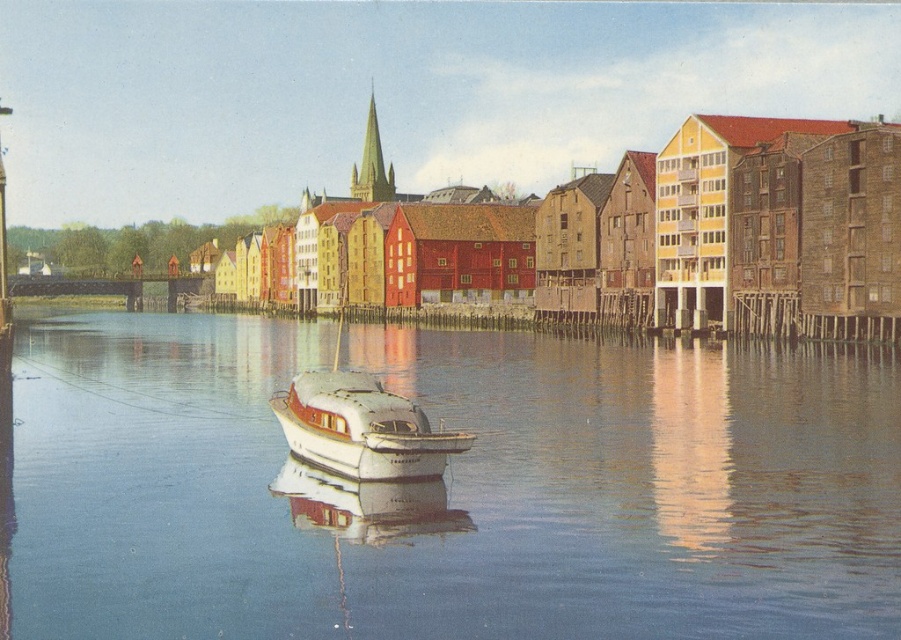
Question: Among these objects, which one is nearest to the camera?

Choices:
 (A) white glossy boat at center
 (B) blue smooth water at center

Answer: (B)

Question: Which point appears closest to the camera in this image?

Choices:
 (A) (365, 163)
 (B) (143, 497)

Answer: (B)

Question: Does white glossy boat at center appear over green stone spire at upper center?

Choices:
 (A) no
 (B) yes

Answer: (A)

Question: Is blue smooth water at center above white glossy boat at center?

Choices:
 (A) yes
 (B) no

Answer: (B)

Question: Can you confirm if white glossy boat at center is bigger than green stone spire at upper center?

Choices:
 (A) yes
 (B) no

Answer: (B)

Question: Estimate the real-world distances between objects in this image. Which object is closer to the green stone spire at upper center?

Choices:
 (A) blue smooth water at center
 (B) white glossy boat at center

Answer: (A)